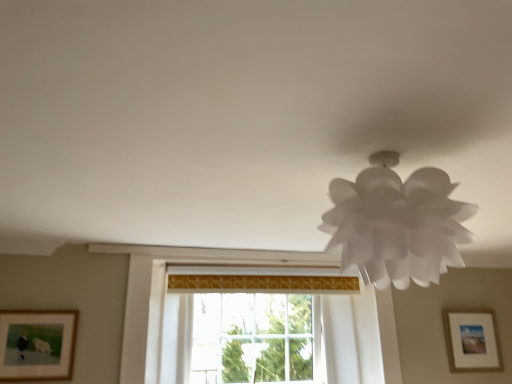
Question: Is matte white picture frame at lower right, which ranks as the first picture frame in right-to-left order, taller or shorter than wooden framed picture at lower left, which appears as the first picture frame when viewed from the left?

Choices:
 (A) tall
 (B) short

Answer: (A)

Question: In the image, is matte white picture frame at lower right, positioned as the first picture frame in back-to-front order, positioned in front of or behind wooden framed picture at lower left, which appears as the first picture frame when viewed from the left?

Choices:
 (A) behind
 (B) front

Answer: (A)

Question: Which is nearer to the transparent glass window at center?

Choices:
 (A) wooden framed picture at lower left, which ranks as the 2th picture frame in right-to-left order
 (B) white paper lamp at upper right
 (C) matte white picture frame at lower right, the second picture frame positioned from the front

Answer: (A)

Question: Estimate the real-world distances between objects in this image. Which object is closer to the wooden framed picture at lower left, the first picture frame positioned from the front?

Choices:
 (A) matte white picture frame at lower right, positioned as the first picture frame in back-to-front order
 (B) transparent glass window at center
 (C) white paper lamp at upper right

Answer: (B)